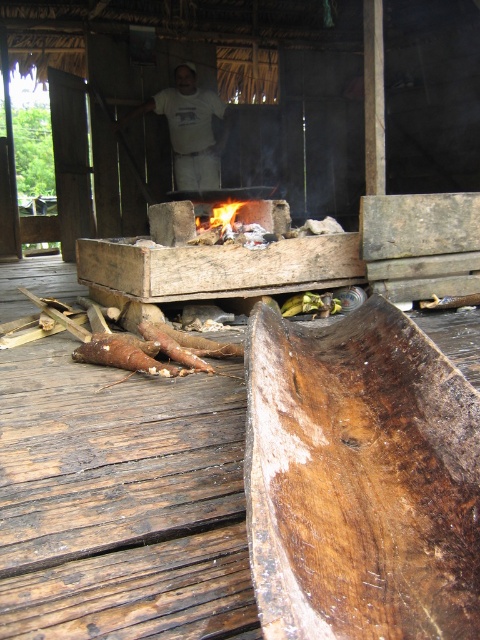
Who is shorter, white cotton shirt at upper center or flame wood fire at center?

flame wood fire at center

Can you confirm if white cotton shirt at upper center is taller than flame wood fire at center?

Indeed, white cotton shirt at upper center has a greater height compared to flame wood fire at center.

The width and height of the screenshot is (480, 640). What are the coordinates of `white cotton shirt at upper center` in the screenshot? It's located at (190, 129).

You are a GUI agent. You are given a task and a screenshot of the screen. Output one action in this format:
    pyautogui.click(x=<x>, y=<y>)
    Task: Click on the white cotton shirt at upper center
    
    Given the screenshot: What is the action you would take?
    pyautogui.click(x=190, y=129)